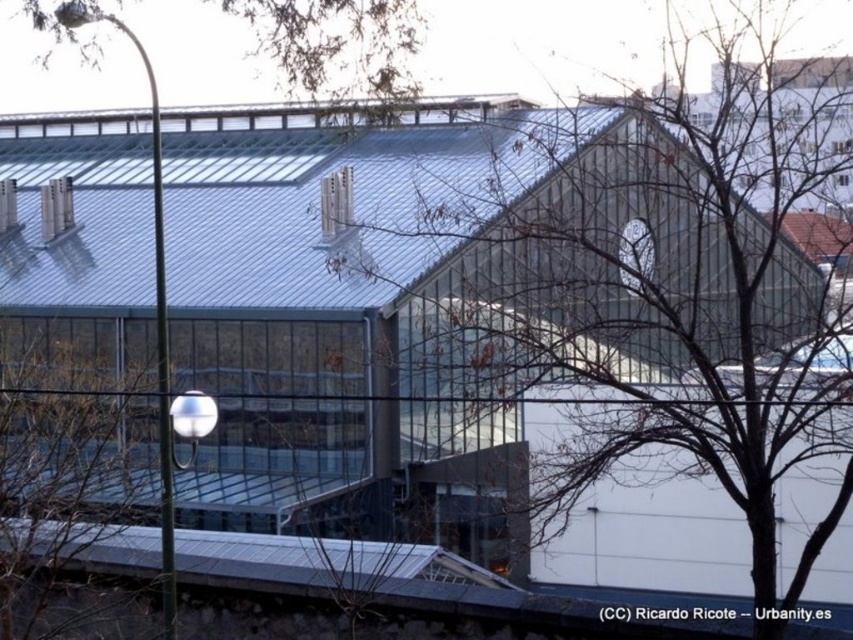
Question: Estimate the real-world distances between objects in this image. Which object is closer to the brown leafy tree at upper center?

Choices:
 (A) transparent glass window at upper center
 (B) clear glass window at center
 (C) bare branches at center

Answer: (C)

Question: Is the position of bare branches at center more distant than that of green leafy tree at left?

Choices:
 (A) no
 (B) yes

Answer: (A)

Question: Estimate the real-world distances between objects in this image. Which object is farther from the bare branches at center?

Choices:
 (A) brown leafy tree at upper center
 (B) clear glass window at center
 (C) transparent glass window at upper center

Answer: (B)

Question: Does bare branches at center have a smaller size compared to brown leafy tree at upper center?

Choices:
 (A) yes
 (B) no

Answer: (A)

Question: Which object is farther from the camera taking this photo?

Choices:
 (A) transparent glass window at upper center
 (B) green leafy tree at left

Answer: (B)

Question: Is transparent glass window at upper center positioned in front of clear glass window at center?

Choices:
 (A) no
 (B) yes

Answer: (B)